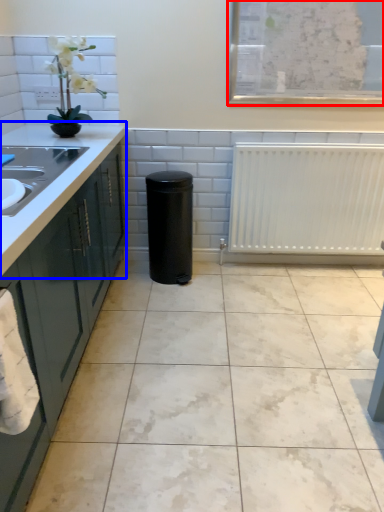
Question: Which object appears farthest to the camera in this image, window screen (highlighted by a red box) or countertop (highlighted by a blue box)?

Choices:
 (A) window screen
 (B) countertop

Answer: (A)